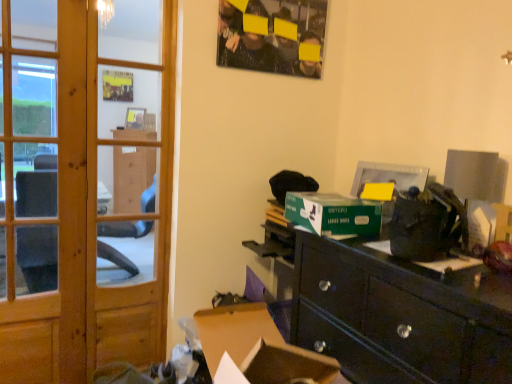
Question: Could you tell me if green cardboard box at center is turned towards matte black poster at upper center?

Choices:
 (A) no
 (B) yes

Answer: (A)

Question: Considering the relative sizes of green cardboard box at center and matte black poster at upper center in the image provided, is green cardboard box at center thinner than matte black poster at upper center?

Choices:
 (A) yes
 (B) no

Answer: (B)

Question: Does green cardboard box at center lie behind matte black poster at upper center?

Choices:
 (A) no
 (B) yes

Answer: (A)

Question: Considering the relative sizes of green cardboard box at center and matte black poster at upper center in the image provided, is green cardboard box at center shorter than matte black poster at upper center?

Choices:
 (A) no
 (B) yes

Answer: (B)

Question: Can you confirm if green cardboard box at center is wider than matte black poster at upper center?

Choices:
 (A) no
 (B) yes

Answer: (B)

Question: Considering the relative positions of green cardboard box at center and matte black poster at upper center in the image provided, is green cardboard box at center to the left of matte black poster at upper center from the viewer's perspective?

Choices:
 (A) no
 (B) yes

Answer: (A)

Question: From a real-world perspective, is wooden door at left beneath green cardboard box at center?

Choices:
 (A) yes
 (B) no

Answer: (A)

Question: Is wooden door at left shorter than green cardboard box at center?

Choices:
 (A) no
 (B) yes

Answer: (A)

Question: Is wooden door at left completely or partially outside of green cardboard box at center?

Choices:
 (A) no
 (B) yes

Answer: (B)

Question: Is wooden door at left thinner than green cardboard box at center?

Choices:
 (A) no
 (B) yes

Answer: (B)

Question: Is the surface of wooden door at left in direct contact with green cardboard box at center?

Choices:
 (A) no
 (B) yes

Answer: (A)

Question: Would you consider wooden door at left to be distant from green cardboard box at center?

Choices:
 (A) no
 (B) yes

Answer: (A)

Question: Is green cardboard box at center facing towards wooden door at left?

Choices:
 (A) no
 (B) yes

Answer: (B)